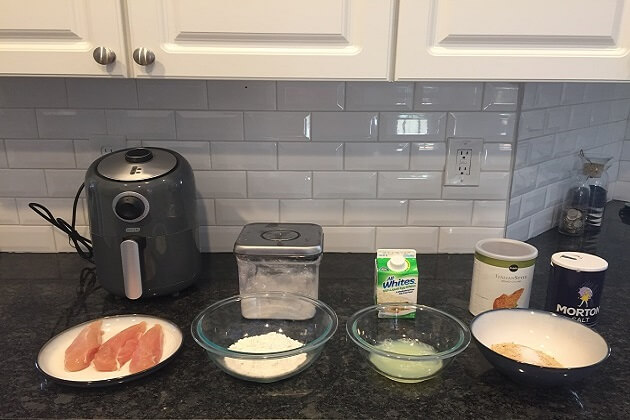
You are a GUI agent. You are given a task and a screenshot of the screen. Output one action in this format:
    pyautogui.click(x=<x>, y=<y>)
    Task: Click on the appliance
    The width and height of the screenshot is (630, 420).
    Given the screenshot: What is the action you would take?
    pyautogui.click(x=144, y=222)